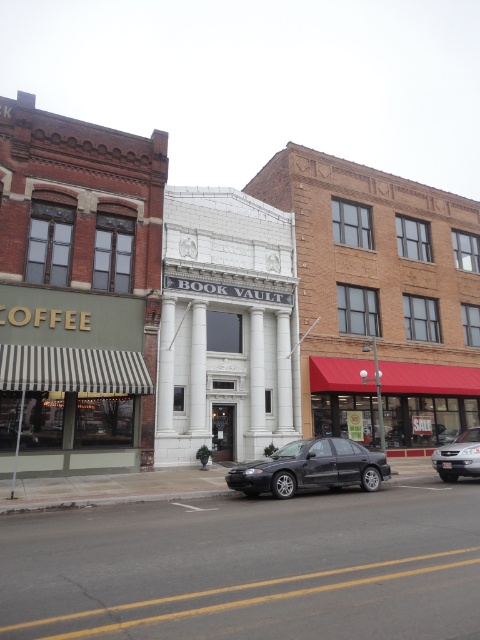
Question: Which is farther from the matte black sedan at center?

Choices:
 (A) satin silver sedan at lower right
 (B) matte white building at center

Answer: (B)

Question: In this image, where is matte white building at center located relative to satin silver sedan at lower right?

Choices:
 (A) right
 (B) left

Answer: (B)

Question: Which of the following is the farthest from the observer?

Choices:
 (A) (479, 440)
 (B) (36, 273)
 (C) (249, 481)

Answer: (B)

Question: Is the position of matte white building at center more distant than that of satin silver sedan at lower right?

Choices:
 (A) yes
 (B) no

Answer: (A)

Question: Can you confirm if matte black sedan at center is bigger than satin silver sedan at lower right?

Choices:
 (A) no
 (B) yes

Answer: (B)

Question: Estimate the real-world distances between objects in this image. Which object is farther from the satin silver sedan at lower right?

Choices:
 (A) matte black sedan at center
 (B) matte white building at center

Answer: (B)